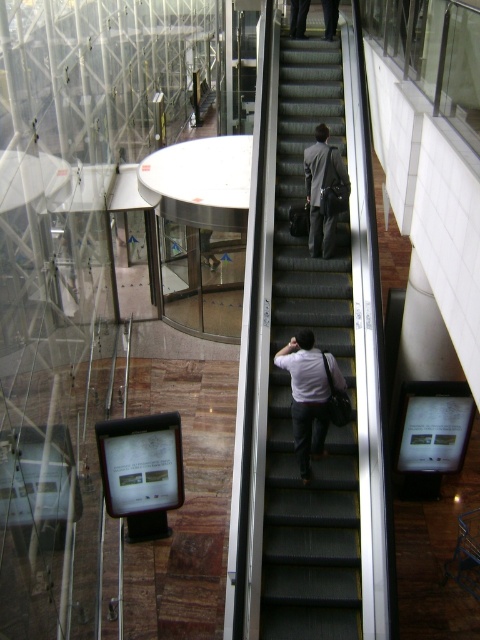
Question: Which object is positioned closest to the black carpeted stairs at center?

Choices:
 (A) white matte shirt at center
 (B) gray suit at center

Answer: (B)

Question: Which of the following is the farthest from the observer?

Choices:
 (A) gray suit at center
 (B) black carpeted stairs at center
 (C) white matte shirt at center

Answer: (A)

Question: Among these points, which one is nearest to the camera?

Choices:
 (A) (347, 220)
 (B) (321, 438)
 (C) (310, 172)

Answer: (B)

Question: Is black carpeted stairs at center wider than white matte shirt at center?

Choices:
 (A) no
 (B) yes

Answer: (B)

Question: Does black carpeted stairs at center have a smaller size compared to gray suit at center?

Choices:
 (A) yes
 (B) no

Answer: (B)

Question: Observing the image, what is the correct spatial positioning of black carpeted stairs at center in reference to gray suit at center?

Choices:
 (A) left
 (B) right

Answer: (A)